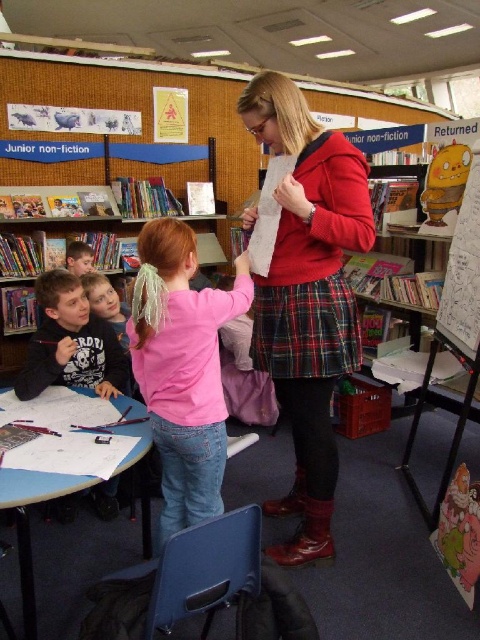
Question: Which point is closer to the camera?

Choices:
 (A) (100, 372)
 (B) (166, 224)
 (C) (450, 275)
 (D) (316, 449)

Answer: (B)

Question: Is wooden bookshelf at left closer to the viewer compared to cartoon paperboard at right?

Choices:
 (A) yes
 (B) no

Answer: (B)

Question: Does red plaid skirt at center appear on the right side of cartoon paperboard at right?

Choices:
 (A) no
 (B) yes

Answer: (A)

Question: Which object appears closest to the camera in this image?

Choices:
 (A) pink matte shirt at center
 (B) red plaid skirt at center

Answer: (A)

Question: Which of the following is the closest to the observer?

Choices:
 (A) matte black shirt at left
 (B) cartoon paperboard at right
 (C) wooden bookshelf at left

Answer: (A)

Question: Is matte black shirt at left to the left of wooden bookshelf at left from the viewer's perspective?

Choices:
 (A) yes
 (B) no

Answer: (B)